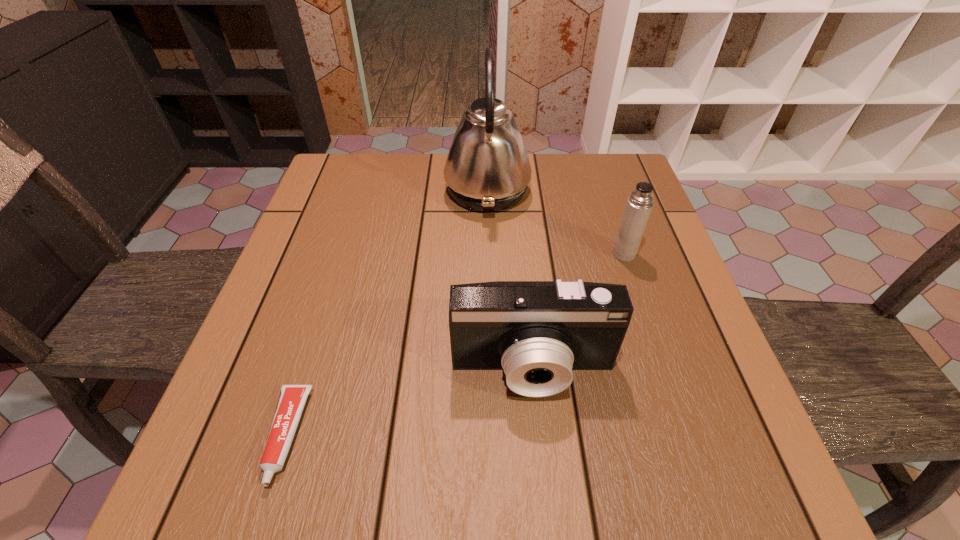
Locate an element on the screen. The image size is (960, 540). kettle is located at coordinates (487, 169).

Find the location of a particular element. The width and height of the screenshot is (960, 540). the tallest object is located at coordinates (487, 169).

Locate an element on the screen. the rightmost object is located at coordinates (639, 204).

The image size is (960, 540). Find the location of `thermos bottle`. thermos bottle is located at coordinates (639, 204).

Identify the location of camcorder. (536, 331).

The width and height of the screenshot is (960, 540). Identify the location of the leftmost object. (292, 399).

Identify the location of toothpaste. Image resolution: width=960 pixels, height=540 pixels. (x=292, y=399).

At what (x,y) coordinates should I click in order to perform the action: click on vacant space located from the spout of the tallest object. Please return your answer as a coordinate pair (x, y). Looking at the image, I should click on (367, 191).

Identify the location of vacant region located 0.190m from the spout of the tallest object. This screenshot has width=960, height=540. (374, 191).

Where is `blank space located 0.050m from the spout of the tallest object`? Image resolution: width=960 pixels, height=540 pixels. blank space located 0.050m from the spout of the tallest object is located at coordinates (426, 191).